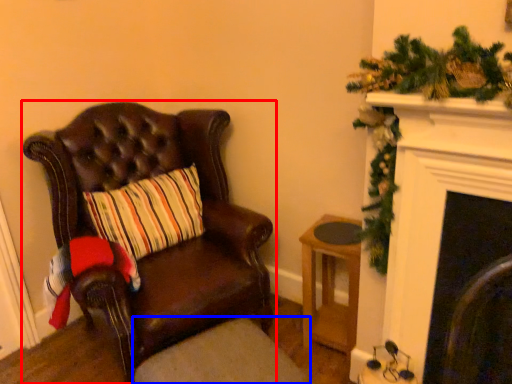
Question: Which point is closer to the camera, chair (highlighted by a red box) or footrest (highlighted by a blue box)?

Choices:
 (A) chair
 (B) footrest

Answer: (B)